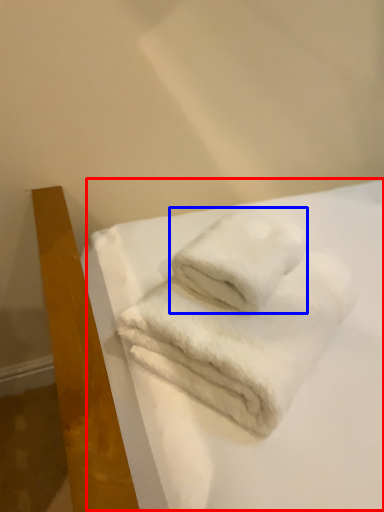
Question: Which object is closer to the camera taking this photo, sheet (highlighted by a red box) or towel (highlighted by a blue box)?

Choices:
 (A) sheet
 (B) towel

Answer: (A)